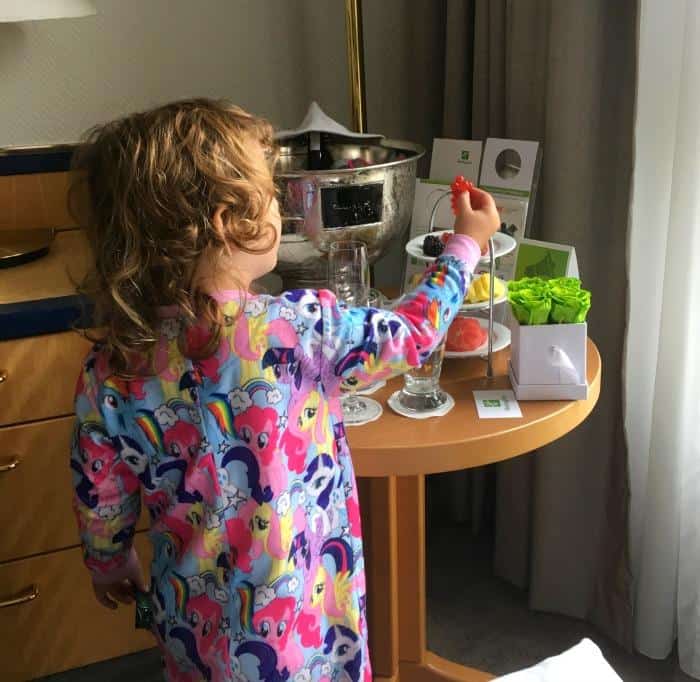
Locate an element on the screen. glass is located at coordinates (435, 376), (343, 264).